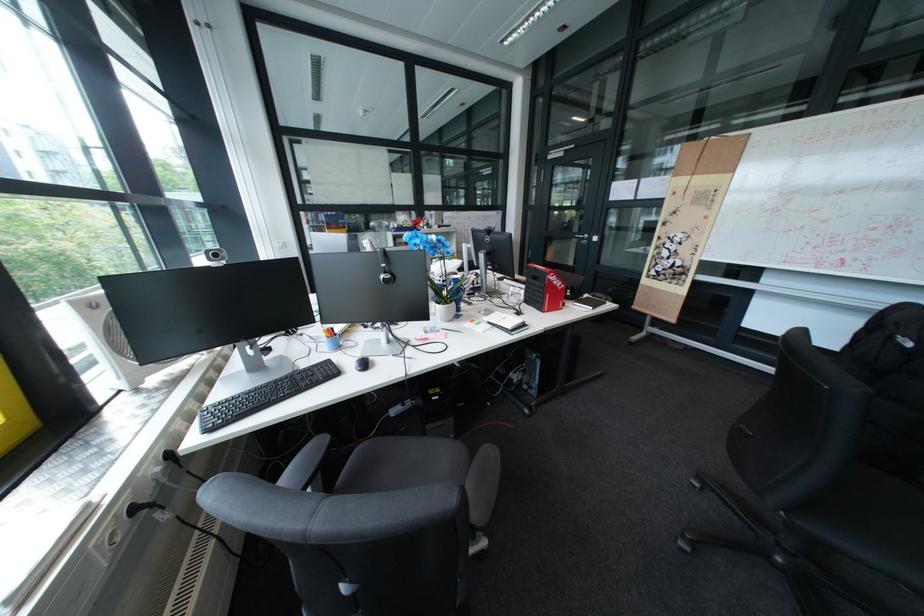
Where would you resting arm the grey chair armrest? Please return your answer as a coordinate pair (x, y).

(482, 485)